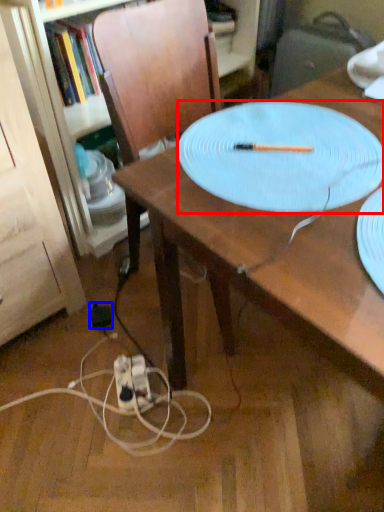
Question: Which point is further to the camera, platter (highlighted by a red box) or electric outlet (highlighted by a blue box)?

Choices:
 (A) platter
 (B) electric outlet

Answer: (B)